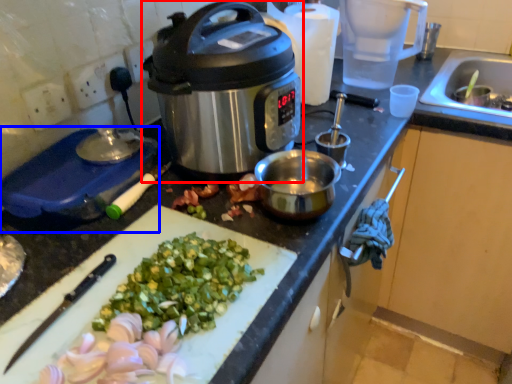
Question: Which point is closer to the camera, slow cooker (highlighted by a red box) or kitchen appliance (highlighted by a blue box)?

Choices:
 (A) slow cooker
 (B) kitchen appliance

Answer: (A)